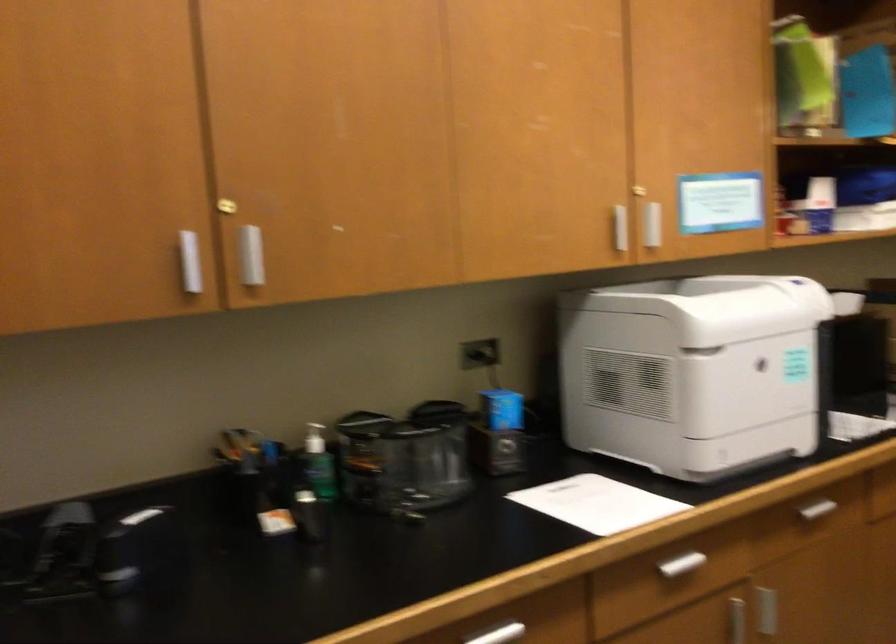
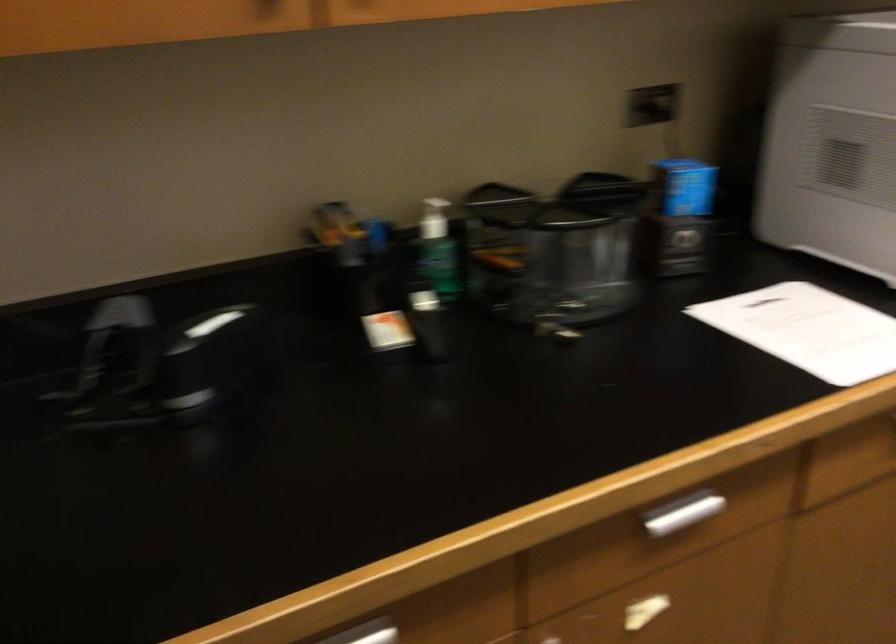
Where in the second image is the point corresponding to (503,409) from the first image?

(684, 187)